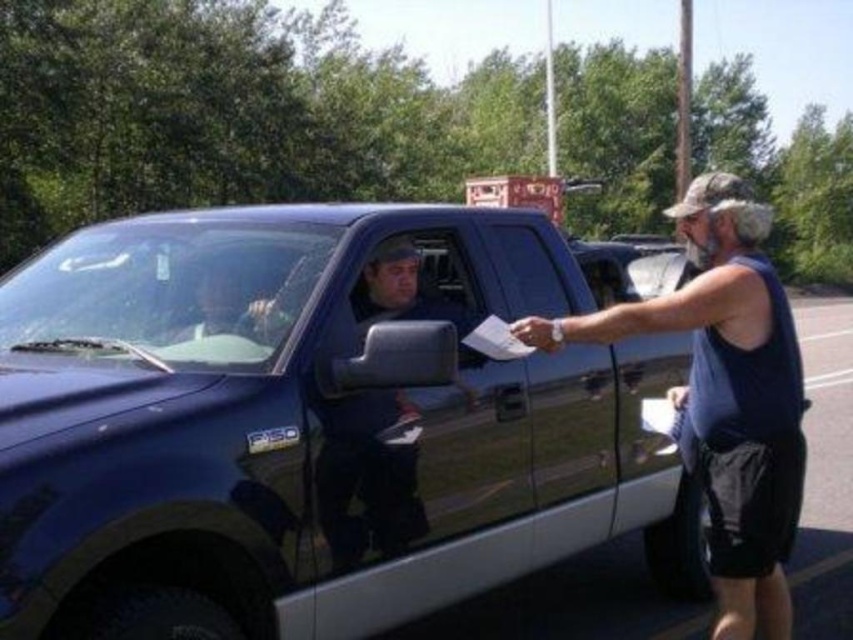
Does glossy blue truck at center have a smaller size compared to glossy blue truck at right?

Actually, glossy blue truck at center might be larger than glossy blue truck at right.

Based on the photo, who is more forward, (581,524) or (711,317)?

Positioned in front is point (711,317).

Is point (421, 412) closer to camera compared to point (778, 324)?

No, (421, 412) is further to viewer.

This screenshot has height=640, width=853. What are the coordinates of `glossy blue truck at center` in the screenshot? It's located at (310, 428).